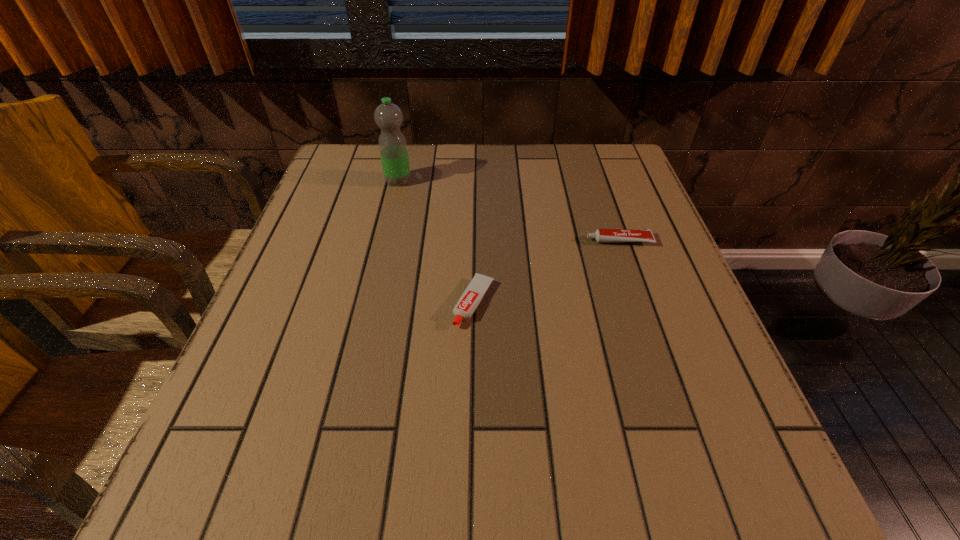
The image size is (960, 540). What are the coordinates of `vacant point located between the rightmost object and the left toothpaste` in the screenshot? It's located at (547, 272).

Find the location of `vacant area that lies between the left toothpaste and the farthest object`. vacant area that lies between the left toothpaste and the farthest object is located at coordinates (436, 242).

Locate an element on the screen. The image size is (960, 540). blank region between the water bottle and the farther toothpaste is located at coordinates (509, 211).

Identify the location of empty location between the second object from right to left and the rightmost object. (547, 272).

Locate an element on the screen. The height and width of the screenshot is (540, 960). vacant space that's between the second object from right to left and the right toothpaste is located at coordinates (547, 272).

Image resolution: width=960 pixels, height=540 pixels. I want to click on free space between the farthest object and the farther toothpaste, so click(509, 211).

Find the location of a particular element. This screenshot has height=540, width=960. vacant area that lies between the farthest object and the nearest object is located at coordinates 436,242.

Find the location of `free space that is in between the tallest object and the left toothpaste`. free space that is in between the tallest object and the left toothpaste is located at coordinates (436, 242).

Identify the location of free space between the second nearest object and the nearer toothpaste. (547, 272).

Point out which object is positioned as the nearest to the nearest object. Please provide its 2D coordinates. Your answer should be formatted as a tuple, i.e. [(x, y)], where the tuple contains the x and y coordinates of a point satisfying the conditions above.

[(601, 235)]